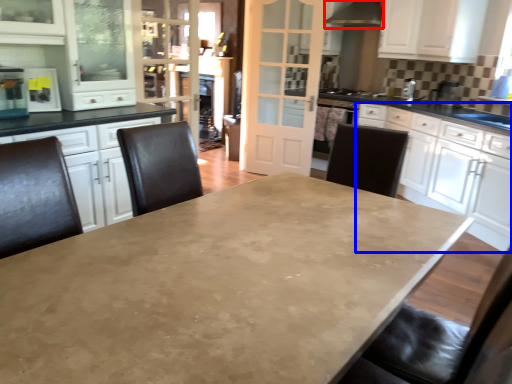
Question: Which object appears farthest to the camera in this image, exhaust hood (highlighted by a red box) or cabinetry (highlighted by a blue box)?

Choices:
 (A) exhaust hood
 (B) cabinetry

Answer: (A)